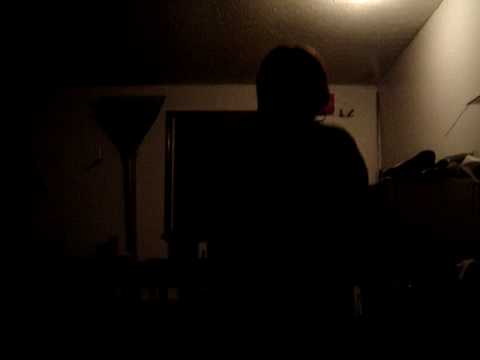
Find the location of a particular element. The width and height of the screenshot is (480, 360). door frame is located at coordinates (167, 150).